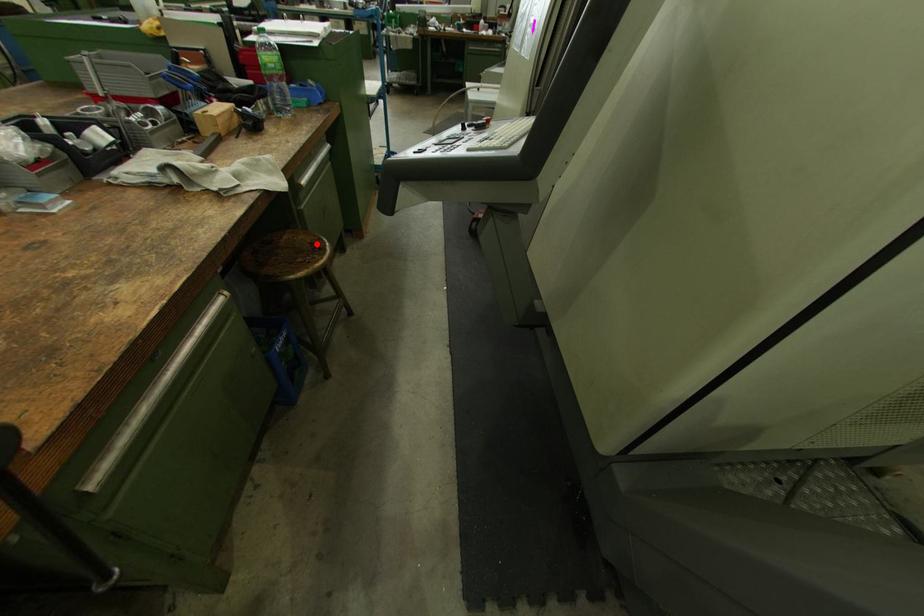
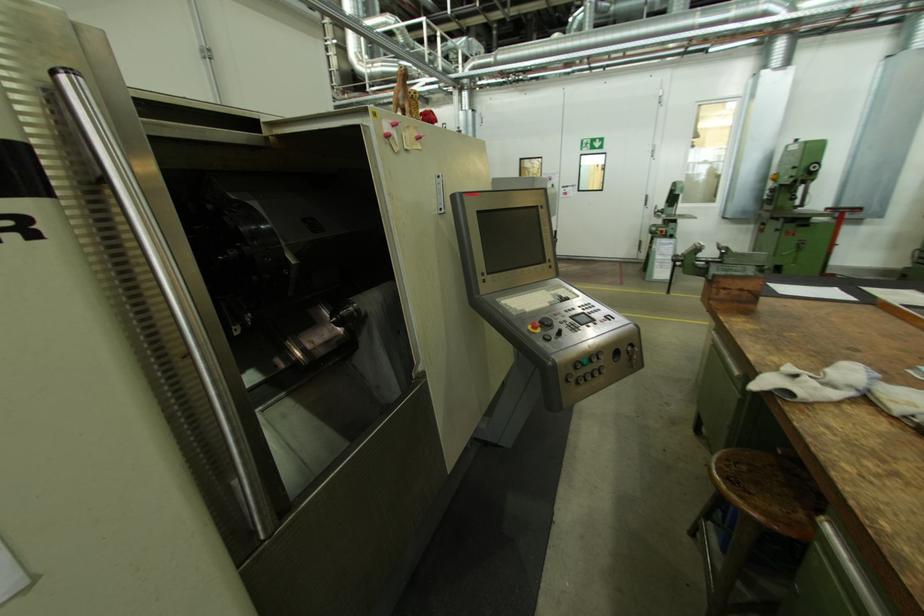
In the second image, find the point that corresponds to the highlighted location in the first image.

(755, 493)